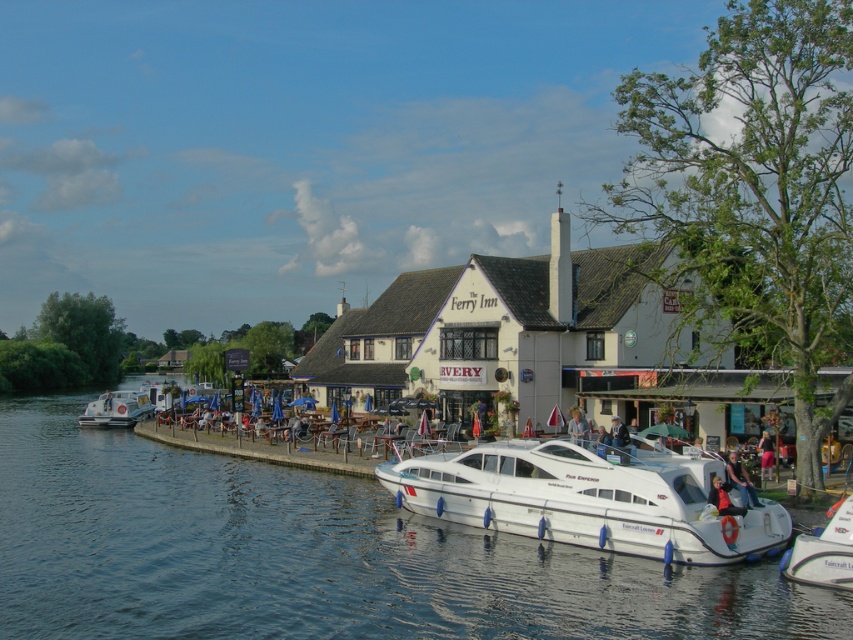
You are a visitor at The Ferry Inn and want to take a photo of both the white glossy motorboat at center and the white glossy houseboat at lower left. Which one will appear larger in the photo?

The white glossy motorboat at center will appear larger in the photo because it is taller than the white glossy houseboat at lower left.

You are a visitor at The Ferry Inn and want to take a photo of the blue water at lower left without the blue denim jacket at center blocking the view. Is there a way to position yourself so the jacket isn

The blue water at lower left is below the blue denim jacket at center, so you can position yourself lower or move to the side to avoid the jacket blocking the view.